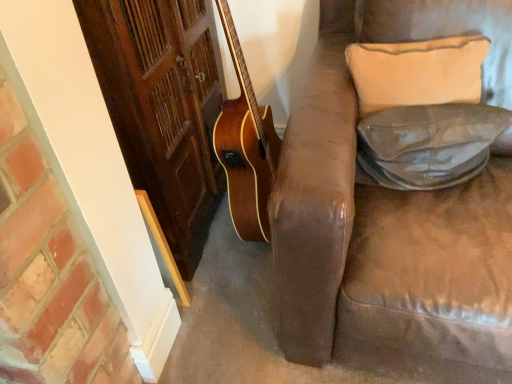
You are a GUI agent. You are given a task and a screenshot of the screen. Output one action in this format:
    pyautogui.click(x=<x>, y=<y>)
    Task: Click on the beige fabric pillow at upper right, the second pillow when ordered from bottom to top
    This screenshot has height=384, width=512.
    Given the screenshot: What is the action you would take?
    pyautogui.click(x=417, y=72)

What do you see at coordinates (417, 72) in the screenshot? I see `beige fabric pillow at upper right, positioned as the first pillow in top-to-bottom order` at bounding box center [417, 72].

The height and width of the screenshot is (384, 512). Describe the element at coordinates (428, 144) in the screenshot. I see `leather at right, which ranks as the second pillow in top-to-bottom order` at that location.

Where is `leather at right, positioned as the 1th pillow in bottom-to-top order`? The image size is (512, 384). leather at right, positioned as the 1th pillow in bottom-to-top order is located at coordinates (428, 144).

At what (x,y) coordinates should I click in order to perform the action: click on beige fabric pillow at upper right, positioned as the first pillow in top-to-bottom order. Please return your answer as a coordinate pair (x, y). Looking at the image, I should click on (417, 72).

Can you confirm if beige fabric pillow at upper right, the second pillow when ordered from bottom to top, is positioned to the right of leather at right, positioned as the 1th pillow in bottom-to-top order?

In fact, beige fabric pillow at upper right, the second pillow when ordered from bottom to top, is to the left of leather at right, positioned as the 1th pillow in bottom-to-top order.

Is beige fabric pillow at upper right, the second pillow when ordered from bottom to top, in front of or behind leather at right, which ranks as the second pillow in top-to-bottom order, in the image?

beige fabric pillow at upper right, the second pillow when ordered from bottom to top, is behind leather at right, which ranks as the second pillow in top-to-bottom order.

Is point (376, 109) farther from viewer compared to point (381, 169)?

That is True.

From the image's perspective, does beige fabric pillow at upper right, the second pillow when ordered from bottom to top, appear higher than leather at right, positioned as the 1th pillow in bottom-to-top order?

Correct, beige fabric pillow at upper right, the second pillow when ordered from bottom to top, appears higher than leather at right, positioned as the 1th pillow in bottom-to-top order, in the image.

Looking at this image, from a real-world perspective, between beige fabric pillow at upper right, positioned as the first pillow in top-to-bottom order, and leather at right, which ranks as the second pillow in top-to-bottom order, who is vertically lower?

leather at right, which ranks as the second pillow in top-to-bottom order.

Looking at their sizes, would you say beige fabric pillow at upper right, the second pillow when ordered from bottom to top, is wider or thinner than leather at right, which ranks as the second pillow in top-to-bottom order?

In the image, beige fabric pillow at upper right, the second pillow when ordered from bottom to top, appears to be wider than leather at right, which ranks as the second pillow in top-to-bottom order.

Can you confirm if beige fabric pillow at upper right, the second pillow when ordered from bottom to top, is shorter than leather at right, positioned as the 1th pillow in bottom-to-top order?

No.

Considering the relative sizes of beige fabric pillow at upper right, the second pillow when ordered from bottom to top, and leather at right, positioned as the 1th pillow in bottom-to-top order, in the image provided, is beige fabric pillow at upper right, the second pillow when ordered from bottom to top, smaller than leather at right, positioned as the 1th pillow in bottom-to-top order,?

No, beige fabric pillow at upper right, the second pillow when ordered from bottom to top, is not smaller than leather at right, positioned as the 1th pillow in bottom-to-top order.

Would you say leather at right, positioned as the 1th pillow in bottom-to-top order, is part of beige fabric pillow at upper right, positioned as the first pillow in top-to-bottom order,'s contents?

No, beige fabric pillow at upper right, positioned as the first pillow in top-to-bottom order, does not contain leather at right, positioned as the 1th pillow in bottom-to-top order.

Would you consider beige fabric pillow at upper right, positioned as the first pillow in top-to-bottom order, to be distant from leather at right, positioned as the 1th pillow in bottom-to-top order?

No, beige fabric pillow at upper right, positioned as the first pillow in top-to-bottom order, is in close proximity to leather at right, positioned as the 1th pillow in bottom-to-top order.

Is beige fabric pillow at upper right, the second pillow when ordered from bottom to top, oriented away from leather at right, positioned as the 1th pillow in bottom-to-top order?

No, beige fabric pillow at upper right, the second pillow when ordered from bottom to top, is not facing the opposite direction of leather at right, positioned as the 1th pillow in bottom-to-top order.

This screenshot has width=512, height=384. In order to click on pillow below the beige fabric pillow at upper right, positioned as the first pillow in top-to-bottom order (from the image's perspective) in this screenshot , I will do `click(428, 144)`.

Considering the positions of objects leather at right, which ranks as the second pillow in top-to-bottom order, and beige fabric pillow at upper right, positioned as the first pillow in top-to-bottom order, in the image provided, who is more to the left, leather at right, which ranks as the second pillow in top-to-bottom order, or beige fabric pillow at upper right, positioned as the first pillow in top-to-bottom order,?

beige fabric pillow at upper right, positioned as the first pillow in top-to-bottom order.

Which object is further away from the camera taking this photo, leather at right, which ranks as the second pillow in top-to-bottom order, or beige fabric pillow at upper right, positioned as the first pillow in top-to-bottom order?

beige fabric pillow at upper right, positioned as the first pillow in top-to-bottom order.

Which is behind, point (367, 169) or point (413, 99)?

The point (367, 169) is more distant.

From the image's perspective, which is below, leather at right, positioned as the 1th pillow in bottom-to-top order, or beige fabric pillow at upper right, positioned as the first pillow in top-to-bottom order?

leather at right, positioned as the 1th pillow in bottom-to-top order, appears lower in the image.

From a real-world perspective, is leather at right, positioned as the 1th pillow in bottom-to-top order, physically above beige fabric pillow at upper right, the second pillow when ordered from bottom to top?

No, from a real-world perspective, leather at right, positioned as the 1th pillow in bottom-to-top order, is not over beige fabric pillow at upper right, the second pillow when ordered from bottom to top

Consider the image. Which object is thinner, leather at right, positioned as the 1th pillow in bottom-to-top order, or beige fabric pillow at upper right, positioned as the first pillow in top-to-bottom order?

leather at right, positioned as the 1th pillow in bottom-to-top order, is thinner.

Is leather at right, which ranks as the second pillow in top-to-bottom order, taller than beige fabric pillow at upper right, positioned as the first pillow in top-to-bottom order?

No, leather at right, which ranks as the second pillow in top-to-bottom order, is not taller than beige fabric pillow at upper right, positioned as the first pillow in top-to-bottom order.

Is leather at right, positioned as the 1th pillow in bottom-to-top order, smaller than beige fabric pillow at upper right, positioned as the first pillow in top-to-bottom order?

Correct, leather at right, positioned as the 1th pillow in bottom-to-top order, occupies less space than beige fabric pillow at upper right, positioned as the first pillow in top-to-bottom order.

Is leather at right, which ranks as the second pillow in top-to-bottom order, positioned beyond the bounds of beige fabric pillow at upper right, the second pillow when ordered from bottom to top?

Yes, leather at right, which ranks as the second pillow in top-to-bottom order, is outside of beige fabric pillow at upper right, the second pillow when ordered from bottom to top.

Is leather at right, which ranks as the second pillow in top-to-bottom order, not near beige fabric pillow at upper right, positioned as the first pillow in top-to-bottom order?

No, leather at right, which ranks as the second pillow in top-to-bottom order, is not far away from beige fabric pillow at upper right, positioned as the first pillow in top-to-bottom order.

Is leather at right, positioned as the 1th pillow in bottom-to-top order, aimed at beige fabric pillow at upper right, positioned as the first pillow in top-to-bottom order?

No, leather at right, positioned as the 1th pillow in bottom-to-top order, is not aimed at beige fabric pillow at upper right, positioned as the first pillow in top-to-bottom order.

Locate an element on the screen. Image resolution: width=512 pixels, height=384 pixels. pillow below the beige fabric pillow at upper right, positioned as the first pillow in top-to-bottom order (from the image's perspective) is located at coordinates (428, 144).

Find the location of a particular element. The height and width of the screenshot is (384, 512). pillow behind the leather at right, positioned as the 1th pillow in bottom-to-top order is located at coordinates (417, 72).

Find the location of a particular element. The width and height of the screenshot is (512, 384). pillow beneath the beige fabric pillow at upper right, the second pillow when ordered from bottom to top (from a real-world perspective) is located at coordinates (428, 144).